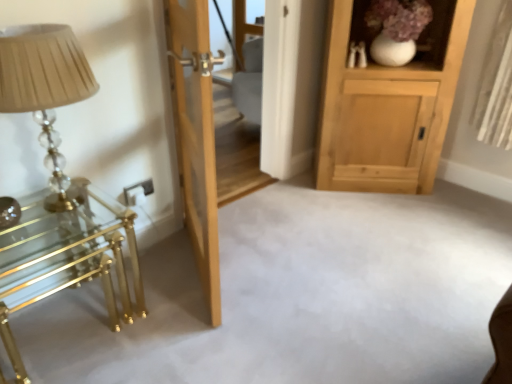
Question: Is natural wood door at center positioned beyond the bounds of translucent glass table lamp at left?

Choices:
 (A) no
 (B) yes

Answer: (B)

Question: Is natural wood door at center smaller than translucent glass table lamp at left?

Choices:
 (A) yes
 (B) no

Answer: (B)

Question: From the image's perspective, is natural wood door at center located above translucent glass table lamp at left?

Choices:
 (A) no
 (B) yes

Answer: (A)

Question: From a real-world perspective, is natural wood door at center beneath translucent glass table lamp at left?

Choices:
 (A) no
 (B) yes

Answer: (B)

Question: Is natural wood door at center touching translucent glass table lamp at left?

Choices:
 (A) no
 (B) yes

Answer: (A)

Question: Does natural wood door at center appear on the right side of translucent glass table lamp at left?

Choices:
 (A) yes
 (B) no

Answer: (A)

Question: From a real-world perspective, does polished brass table at left sit lower than natural wood door at center?

Choices:
 (A) no
 (B) yes

Answer: (B)

Question: Can you confirm if polished brass table at left is smaller than natural wood door at center?

Choices:
 (A) yes
 (B) no

Answer: (A)

Question: Considering the relative positions of polished brass table at left and natural wood door at center in the image provided, is polished brass table at left to the right of natural wood door at center from the viewer's perspective?

Choices:
 (A) no
 (B) yes

Answer: (A)

Question: Can you confirm if polished brass table at left is positioned to the left of natural wood door at center?

Choices:
 (A) no
 (B) yes

Answer: (B)

Question: Could you tell me if polished brass table at left is turned towards natural wood door at center?

Choices:
 (A) yes
 (B) no

Answer: (B)

Question: Is polished brass table at left further to camera compared to natural wood door at center?

Choices:
 (A) no
 (B) yes

Answer: (B)

Question: Is translucent glass table lamp at left in front of natural wood door at center?

Choices:
 (A) yes
 (B) no

Answer: (A)